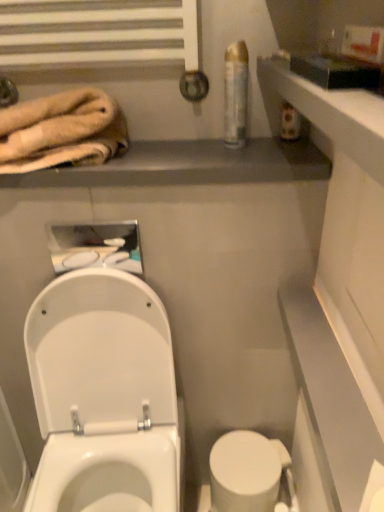
Locate an element on the screen. This screenshot has width=384, height=512. vacant space situated above white glossy toilet bowl at lower center (from a real-world perspective) is located at coordinates (247, 462).